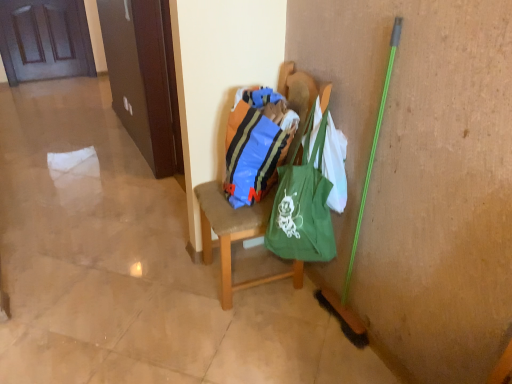
Question: Is blue striped fabric bag at center further to camera compared to green canvas tote at center?

Choices:
 (A) yes
 (B) no

Answer: (A)

Question: From the image's perspective, would you say blue striped fabric bag at center is positioned over green canvas tote at center?

Choices:
 (A) no
 (B) yes

Answer: (B)

Question: From a real-world perspective, is blue striped fabric bag at center over green canvas tote at center?

Choices:
 (A) yes
 (B) no

Answer: (A)

Question: From the image's perspective, does blue striped fabric bag at center appear lower than green canvas tote at center?

Choices:
 (A) yes
 (B) no

Answer: (B)

Question: Considering the relative sizes of blue striped fabric bag at center and green canvas tote at center in the image provided, is blue striped fabric bag at center bigger than green canvas tote at center?

Choices:
 (A) yes
 (B) no

Answer: (B)

Question: Considering the positions of point (203, 246) and point (62, 26), is point (203, 246) closer or farther from the camera than point (62, 26)?

Choices:
 (A) farther
 (B) closer

Answer: (B)

Question: Looking at the image, does wooden chair at center seem bigger or smaller compared to wooden door at upper left?

Choices:
 (A) big
 (B) small

Answer: (A)

Question: From the image's perspective, is wooden chair at center positioned above or below wooden door at upper left?

Choices:
 (A) above
 (B) below

Answer: (B)

Question: Is wooden chair at center in front of or behind wooden door at upper left in the image?

Choices:
 (A) front
 (B) behind

Answer: (A)

Question: Considering the positions of wooden chair at center and green canvas tote at center in the image, is wooden chair at center bigger or smaller than green canvas tote at center?

Choices:
 (A) big
 (B) small

Answer: (A)

Question: From the image's perspective, relative to green canvas tote at center, is wooden chair at center above or below?

Choices:
 (A) below
 (B) above

Answer: (B)

Question: Visually, is wooden chair at center positioned to the left or to the right of green canvas tote at center?

Choices:
 (A) right
 (B) left

Answer: (B)

Question: From a real-world perspective, is wooden chair at center physically located above or below green canvas tote at center?

Choices:
 (A) below
 (B) above

Answer: (A)

Question: Visually, is blue striped fabric bag at center positioned to the left or to the right of green canvas tote at center?

Choices:
 (A) right
 (B) left

Answer: (B)

Question: From a real-world perspective, is blue striped fabric bag at center positioned above or below green canvas tote at center?

Choices:
 (A) above
 (B) below

Answer: (A)